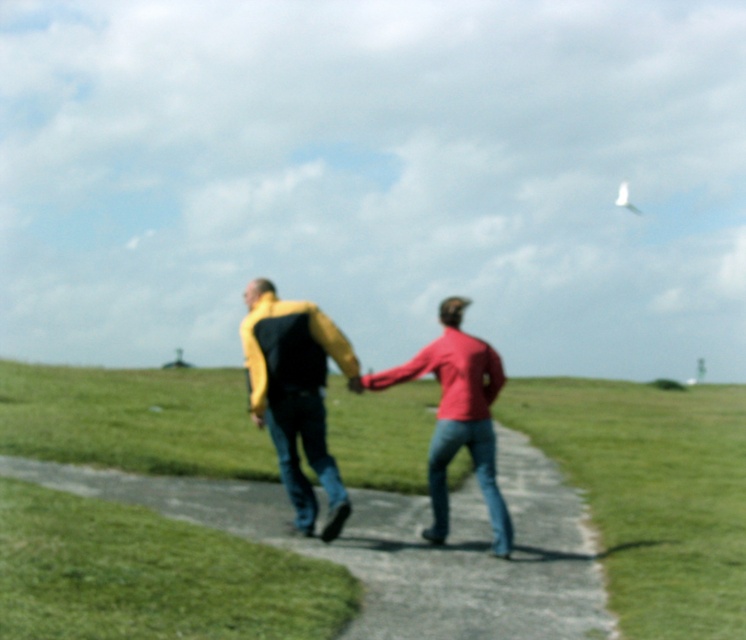
You are a photographer trying to capture a photo of the green grass at center and the yellow fabric jacket at center. Based on their positions, which one should you focus on first to ensure both are in sharp focus?

The green grass at center is in front of the yellow fabric jacket at center, so you should focus on the green grass at center first to ensure both are in sharp focus.